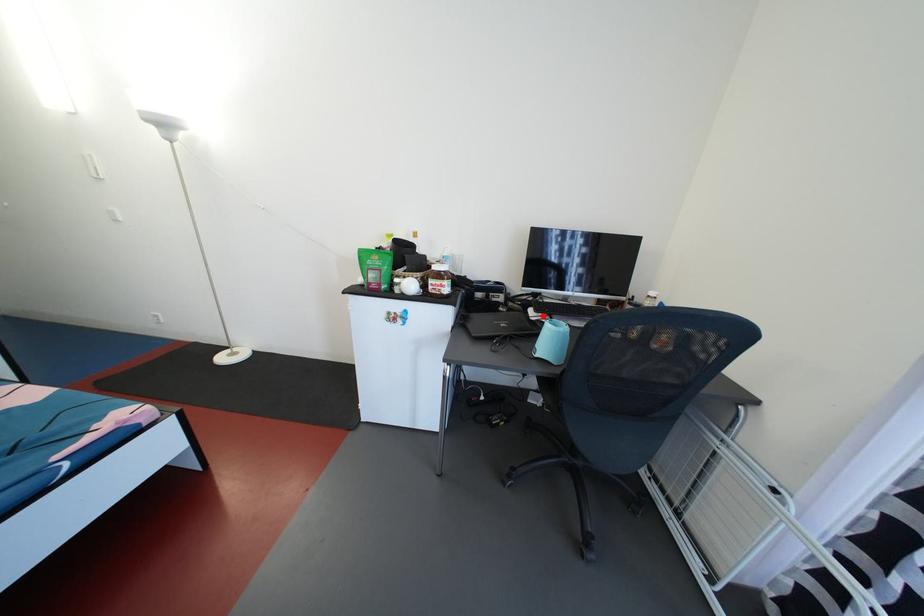
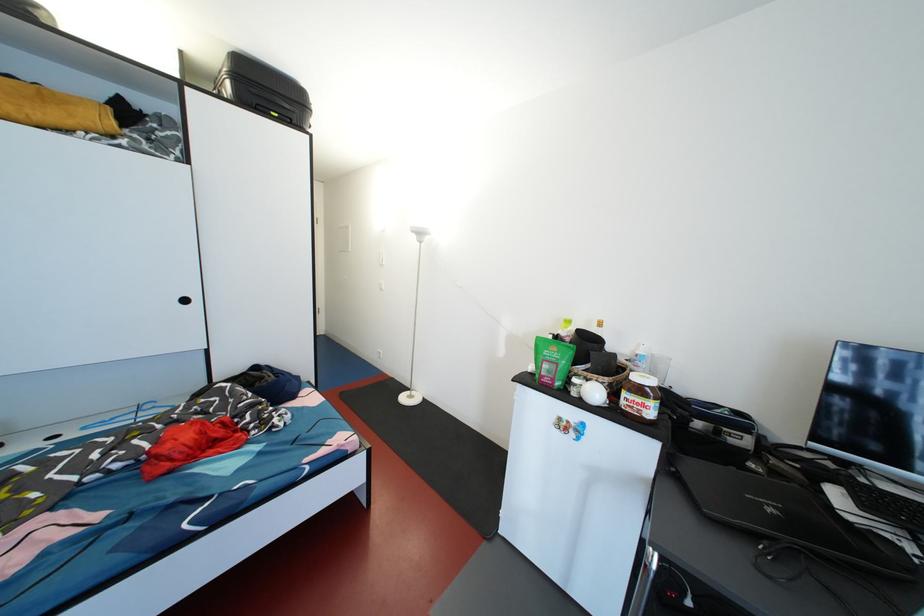
Find the pixel in the second image that matches the highlighted location in the first image.

(869, 511)